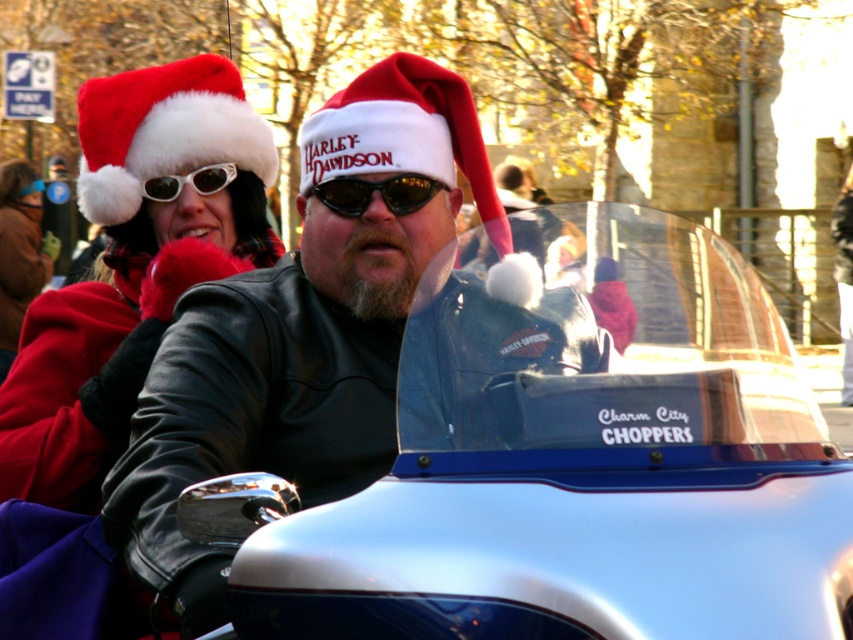
You are a photographer at the event and want to capture a photo where both the metallic blue motorcycle at center and the leather jacket at center are clearly visible. Considering their sizes, which object should you focus on first to ensure proper framing?

The metallic blue motorcycle at center is larger than the leather jacket at center, so you should focus on the metallic blue motorcycle at center first to ensure proper framing.

You are a photographer trying to capture a clear shot of the leather jacket at center and the matte black sunglasses at upper center. Which object should you focus on first to ensure both are in focus?

The leather jacket at center is closer to the viewer than the matte black sunglasses at upper center. To ensure both are in focus, you should focus on the leather jacket at center first, as it is closer, and the depth of field will likely cover the sunglasses behind it.